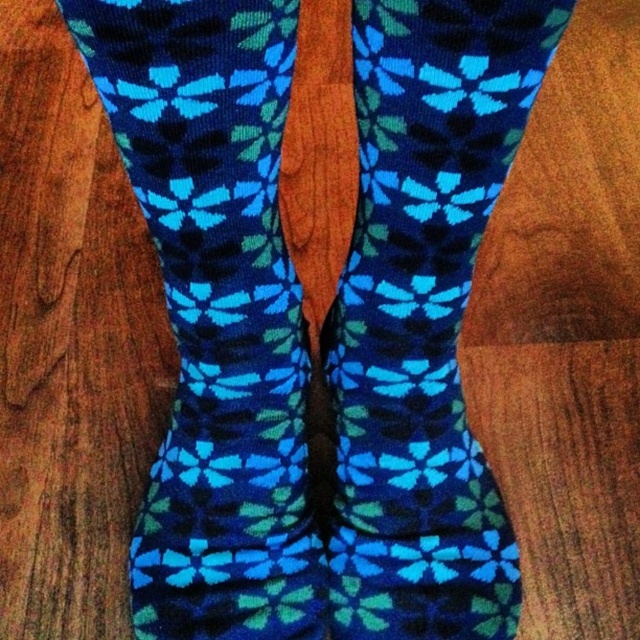
Question: Is blue knitted socks at center bigger than knitted blue socks at center?

Choices:
 (A) yes
 (B) no

Answer: (A)

Question: Among these points, which one is nearest to the camera?

Choices:
 (A) (486, 17)
 (B) (198, 419)

Answer: (A)

Question: Which point appears farthest from the camera in this image?

Choices:
 (A) (195, 332)
 (B) (381, 464)

Answer: (B)

Question: Is blue knitted socks at center above knitted blue socks at center?

Choices:
 (A) yes
 (B) no

Answer: (A)

Question: Can you confirm if blue knitted socks at center is positioned to the right of knitted blue socks at center?

Choices:
 (A) yes
 (B) no

Answer: (B)